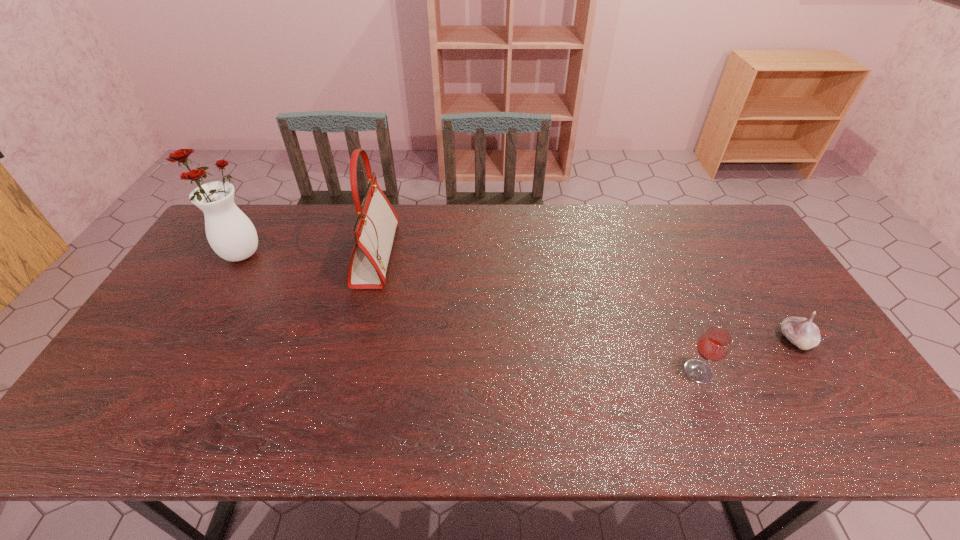
Locate an element on the screen. object identified as the third closest to the vase is located at coordinates (802, 332).

Identify which object is the third nearest to the vase. Please provide its 2D coordinates. Your answer should be formatted as a tuple, i.e. [(x, y)], where the tuple contains the x and y coordinates of a point satisfying the conditions above.

[(802, 332)]

Identify the location of free spot that satisfies the following two spatial constraints: 1. on the front side of the vase; 2. on the right side of the handbag. This screenshot has width=960, height=540. (239, 254).

Find the location of a particular element. free spot that satisfies the following two spatial constraints: 1. on the front side of the nearest object; 2. on the left side of the vase is located at coordinates (170, 372).

Locate an element on the screen. Image resolution: width=960 pixels, height=540 pixels. vacant space that satisfies the following two spatial constraints: 1. on the front side of the vase; 2. on the left side of the rightmost object is located at coordinates (188, 340).

This screenshot has width=960, height=540. Find the location of `free space that satisfies the following two spatial constraints: 1. on the front side of the third object from left to right; 2. on the right side of the handbag`. free space that satisfies the following two spatial constraints: 1. on the front side of the third object from left to right; 2. on the right side of the handbag is located at coordinates (346, 372).